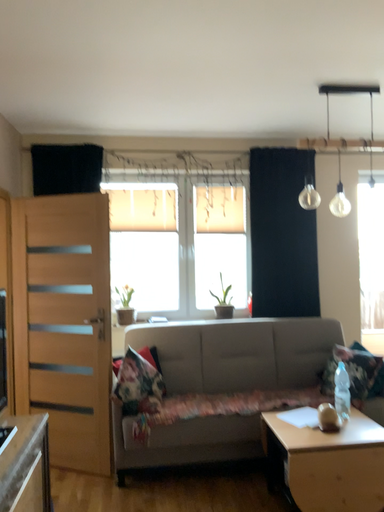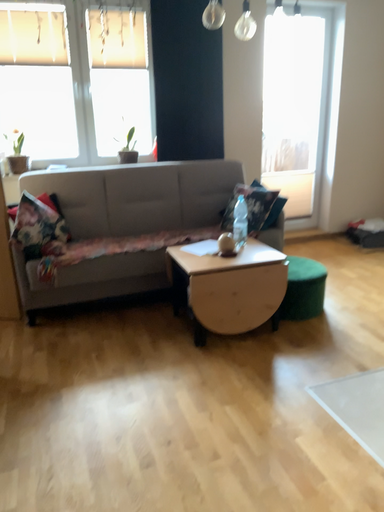
Question: How did the camera likely rotate when shooting the video?

Choices:
 (A) rotated right
 (B) rotated left

Answer: (A)